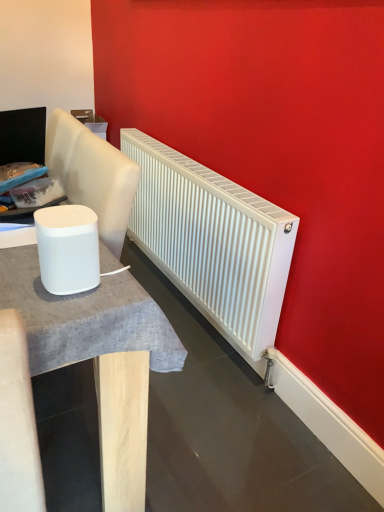
Where is `free space in front of white matte speaker at left`? This screenshot has width=384, height=512. free space in front of white matte speaker at left is located at coordinates (56, 310).